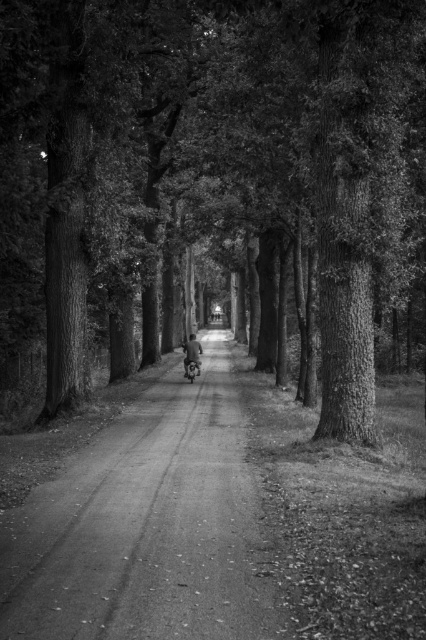
Between point (393, 161) and point (192, 355), which one is positioned behind?

The point (192, 355) is more distant.

Between point (242, 108) and point (199, 364), which one is positioned behind?

The point (199, 364) is behind.

Find the location of `smooth bark tree at center`. smooth bark tree at center is located at coordinates (213, 156).

Does smooth bark tree at center have a greater height compared to smooth asphalt road at center?

Indeed, smooth bark tree at center has a greater height compared to smooth asphalt road at center.

Describe the element at coordinates (213, 156) in the screenshot. This screenshot has width=426, height=640. I see `smooth bark tree at center` at that location.

You are a GUI agent. You are given a task and a screenshot of the screen. Output one action in this format:
    pyautogui.click(x=<x>, y=<y>)
    Task: Click on the smooth bark tree at center
    
    Given the screenshot: What is the action you would take?
    (x=213, y=156)

In the scene shown: Is smooth asphalt road at center wider than metallic silver motorcycle at center?

Correct, the width of smooth asphalt road at center exceeds that of metallic silver motorcycle at center.

Does smooth asphalt road at center appear on the right side of metallic silver motorcycle at center?

Correct, you'll find smooth asphalt road at center to the right of metallic silver motorcycle at center.

Does point (183, 481) come farther from viewer compared to point (196, 364)?

No, it is not.

You are a GUI agent. You are given a task and a screenshot of the screen. Output one action in this format:
    pyautogui.click(x=<x>, y=<y>)
    Task: Click on the smooth asphalt road at center
    This screenshot has height=640, width=426.
    Given the screenshot: What is the action you would take?
    pyautogui.click(x=147, y=525)